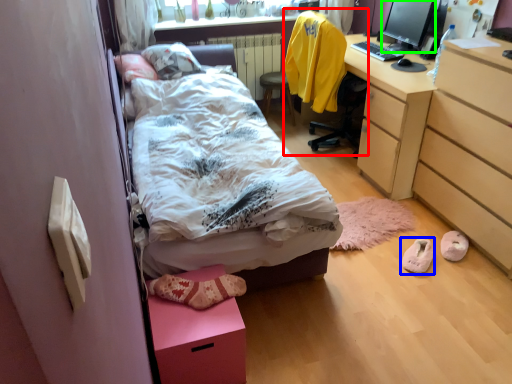
Question: Considering the real-world distances, which object is closest to chair (highlighted by a red box)? footwear (highlighted by a blue box) or computer monitor (highlighted by a green box).

Choices:
 (A) footwear
 (B) computer monitor

Answer: (B)